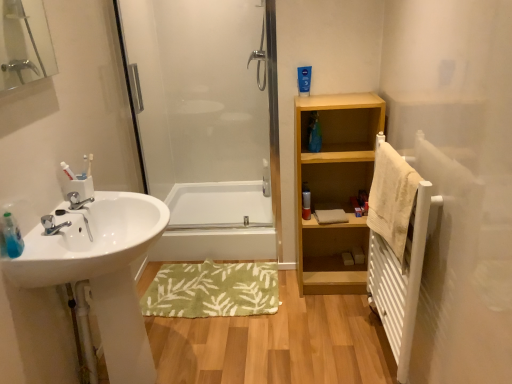
Locate an element on the screen. vacant space that's between light wood shelf at center right and white metallic radiator at right is located at coordinates (344, 323).